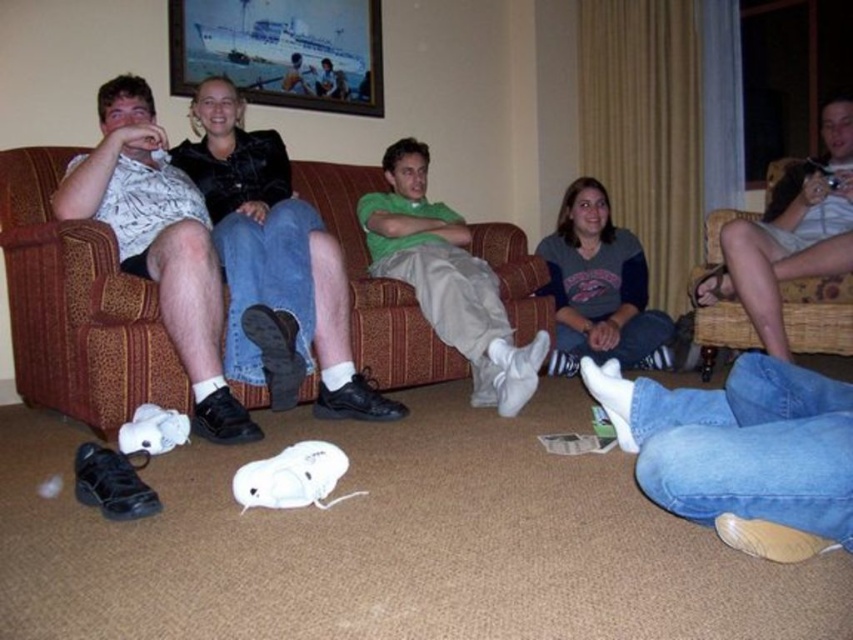
You are standing at point (811, 184) and want to walk to the sofa. There is a point (196, 262) in your path. Will you need to step over it?

Point (196, 262) is in front of point (811, 184), so you are behind the other point. To reach the sofa, you would need to walk forward past point (196, 262), meaning you would have to step over it if it is an obstacle.